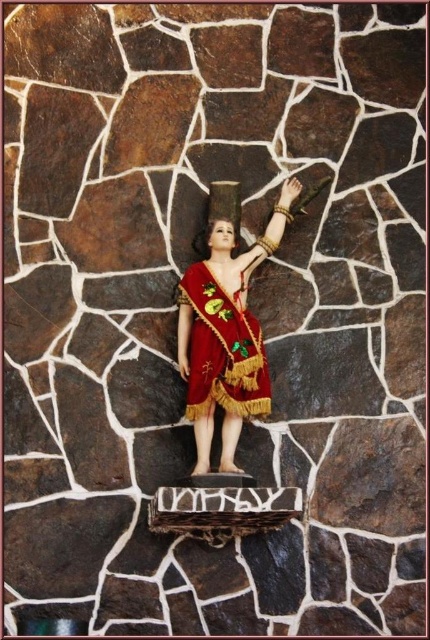
Question: Can you confirm if shiny red fabric doll at center is bigger than velvet-like maroon cape at center?

Choices:
 (A) no
 (B) yes

Answer: (B)

Question: Among these points, which one is nearest to the camera?

Choices:
 (A) (199, 355)
 (B) (212, 221)

Answer: (A)

Question: Which of the following is the closest to the observer?

Choices:
 (A) shiny red fabric doll at center
 (B) velvet-like maroon cape at center

Answer: (A)

Question: Is shiny red fabric doll at center positioned before velvet-like maroon cape at center?

Choices:
 (A) yes
 (B) no

Answer: (A)

Question: Does shiny red fabric doll at center lie behind velvet-like maroon cape at center?

Choices:
 (A) yes
 (B) no

Answer: (B)